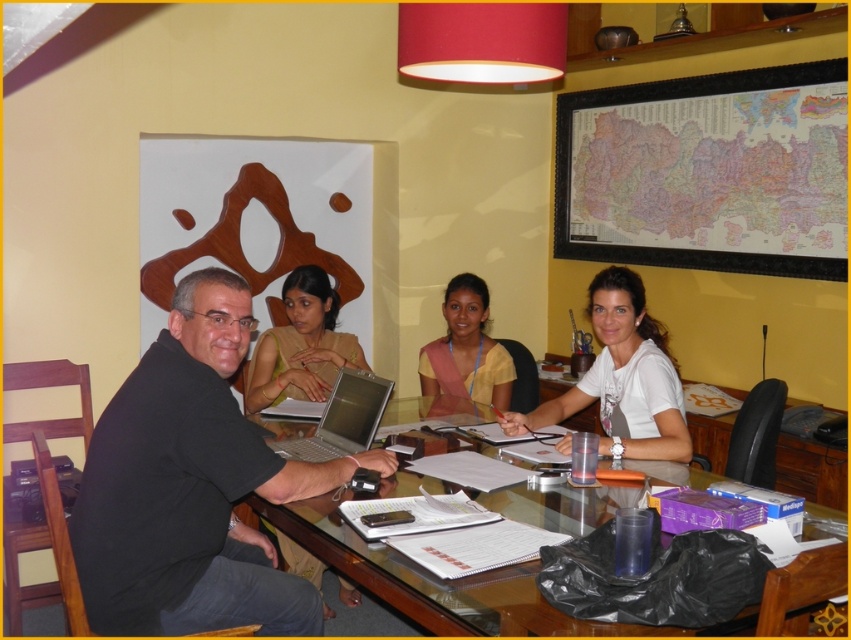
From the picture: Can you confirm if black matte shirt at center is positioned below transparent glass table at center?

No, black matte shirt at center is not below transparent glass table at center.

Describe the element at coordinates (192, 486) in the screenshot. The image size is (851, 640). I see `black matte shirt at center` at that location.

Which is behind, point (373, 468) or point (495, 627)?

The point (373, 468) is behind.

The height and width of the screenshot is (640, 851). In order to click on black matte shirt at center in this screenshot , I will do `click(192, 486)`.

Who is positioned more to the right, transparent glass table at center or yellow matte shirt at center?

yellow matte shirt at center

Does point (415, 588) come in front of point (450, 321)?

Yes, it is in front of point (450, 321).

At what (x,y) coordinates should I click in order to perform the action: click on transparent glass table at center. Please return your answer as a coordinate pair (x, y). The height and width of the screenshot is (640, 851). Looking at the image, I should click on (437, 582).

What do you see at coordinates (621, 378) in the screenshot?
I see `white matte shirt at center` at bounding box center [621, 378].

Who is more distant from viewer, (638, 337) or (252, 401)?

Point (252, 401)

Locate an element on the screen. The height and width of the screenshot is (640, 851). white matte shirt at center is located at coordinates (621, 378).